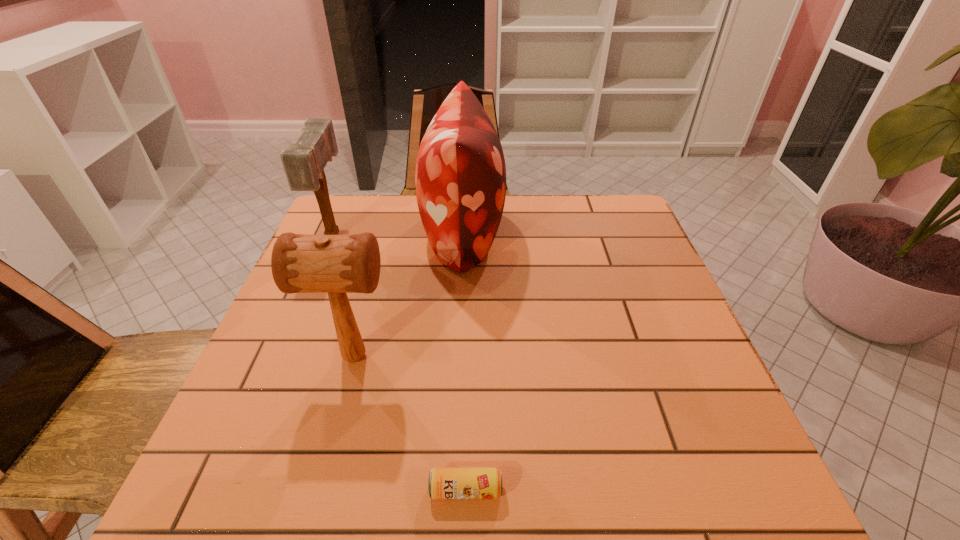
Locate an element on the screen. Image resolution: width=960 pixels, height=540 pixels. vacant region located on the left of the beer can is located at coordinates (349, 490).

Identify the location of cushion located at the far edge. This screenshot has height=540, width=960. (460, 177).

What are the coordinates of `mallet that is at the far edge` in the screenshot? It's located at (304, 163).

You are a GUI agent. You are given a task and a screenshot of the screen. Output one action in this format:
    pyautogui.click(x=<x>, y=<y>)
    Task: Click on the object that is at the near edge
    
    Given the screenshot: What is the action you would take?
    pyautogui.click(x=444, y=483)

The height and width of the screenshot is (540, 960). In order to click on object that is at the far left corner in this screenshot , I will do `click(304, 163)`.

What are the coordinates of `vacant area at the far edge` in the screenshot? It's located at (499, 234).

The height and width of the screenshot is (540, 960). I want to click on vacant region at the near edge of the desktop, so click(631, 455).

Where is `blank space at the left edge`? blank space at the left edge is located at coordinates (256, 361).

Image resolution: width=960 pixels, height=540 pixels. Find the location of `vacant space at the right edge of the desktop`. vacant space at the right edge of the desktop is located at coordinates (684, 369).

Identify the location of vacant space at the far left corner of the desktop. This screenshot has width=960, height=540. (347, 223).